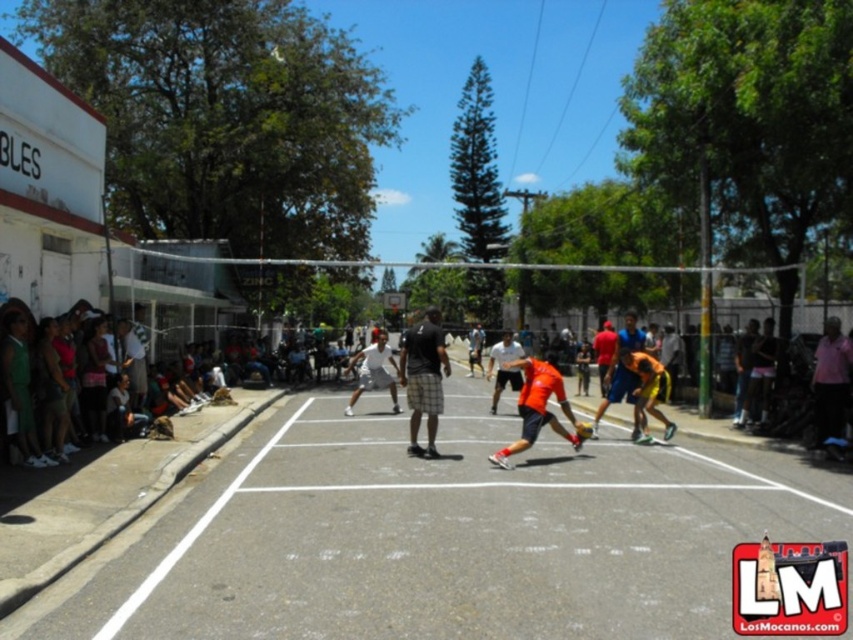
Is white asphalt court at center positioned at the back of white matte shorts at center?

No.

Does white asphalt court at center have a larger size compared to white matte shorts at center?

Incorrect, white asphalt court at center is not larger than white matte shorts at center.

Is point (347, 508) positioned after point (374, 348)?

No, it is in front of (374, 348).

Where is `white asphalt court at center`? The height and width of the screenshot is (640, 853). white asphalt court at center is located at coordinates (439, 536).

From the picture: Does black cotton shirt at center come behind white matte shorts at center?

No, it is not.

Consider the image. Who is taller, black cotton shirt at center or white matte shorts at center?

black cotton shirt at center

Where is `black cotton shirt at center`? The width and height of the screenshot is (853, 640). black cotton shirt at center is located at coordinates (422, 378).

Who is shorter, white asphalt court at center or orange fabric shirt at center?

With less height is white asphalt court at center.

Can you confirm if white asphalt court at center is positioned to the right of orange fabric shirt at center?

Incorrect, white asphalt court at center is not on the right side of orange fabric shirt at center.

Who is more forward, [282,518] or [519,385]?

Point [282,518]

Identify the location of white asphalt court at center. (439, 536).